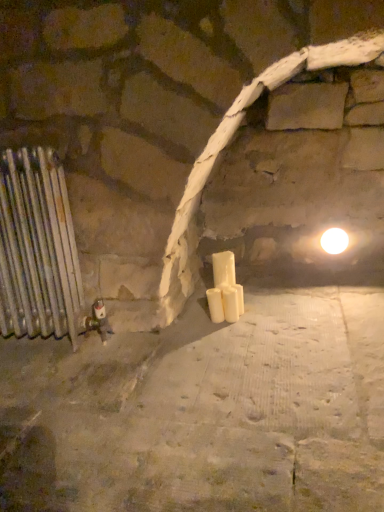
Question: Considering the relative positions of silver metallic radiator at left and white matte candle at center, which ranks as the first candle in right-to-left order, in the image provided, is silver metallic radiator at left to the left of white matte candle at center, which ranks as the first candle in right-to-left order, from the viewer's perspective?

Choices:
 (A) no
 (B) yes

Answer: (B)

Question: Is silver metallic radiator at left thinner than white matte candle at center, which ranks as the first candle in right-to-left order?

Choices:
 (A) yes
 (B) no

Answer: (B)

Question: Is silver metallic radiator at left beside white matte candle at center, placed as the 2th candle when sorted from left to right?

Choices:
 (A) no
 (B) yes

Answer: (A)

Question: Is silver metallic radiator at left behind white matte candle at center, placed as the 2th candle when sorted from left to right?

Choices:
 (A) no
 (B) yes

Answer: (A)

Question: Is silver metallic radiator at left wider than white matte candle at center, placed as the 2th candle when sorted from left to right?

Choices:
 (A) no
 (B) yes

Answer: (B)

Question: From a real-world perspective, is white glossy light bulb at upper right physically located above or below silver metallic radiator at left?

Choices:
 (A) above
 (B) below

Answer: (B)

Question: In the image, is white glossy light bulb at upper right positioned in front of or behind silver metallic radiator at left?

Choices:
 (A) front
 (B) behind

Answer: (B)

Question: Considering the positions of white glossy light bulb at upper right and silver metallic radiator at left in the image, is white glossy light bulb at upper right wider or thinner than silver metallic radiator at left?

Choices:
 (A) thin
 (B) wide

Answer: (A)

Question: Considering the relative positions of white glossy light bulb at upper right and silver metallic radiator at left in the image provided, is white glossy light bulb at upper right to the left or to the right of silver metallic radiator at left?

Choices:
 (A) left
 (B) right

Answer: (B)

Question: Based on their sizes in the image, would you say white matte candle at center, placed as the 2th candle when sorted from left to right, is bigger or smaller than white glossy light bulb at upper right?

Choices:
 (A) big
 (B) small

Answer: (B)

Question: Relative to white glossy light bulb at upper right, is white matte candle at center, placed as the 2th candle when sorted from left to right, in front or behind?

Choices:
 (A) front
 (B) behind

Answer: (A)

Question: From a real-world perspective, is white matte candle at center, which ranks as the first candle in right-to-left order, physically located above or below white glossy light bulb at upper right?

Choices:
 (A) above
 (B) below

Answer: (B)

Question: Visually, is white matte candle at center, which ranks as the first candle in right-to-left order, positioned to the left or to the right of white glossy light bulb at upper right?

Choices:
 (A) left
 (B) right

Answer: (A)

Question: Considering the positions of point (218, 311) and point (221, 294), is point (218, 311) closer or farther from the camera than point (221, 294)?

Choices:
 (A) farther
 (B) closer

Answer: (B)

Question: Is white matte candle at center, arranged as the second candle when viewed from the right, in front of or behind white matte candle at center, placed as the 2th candle when sorted from left to right, in the image?

Choices:
 (A) behind
 (B) front

Answer: (A)